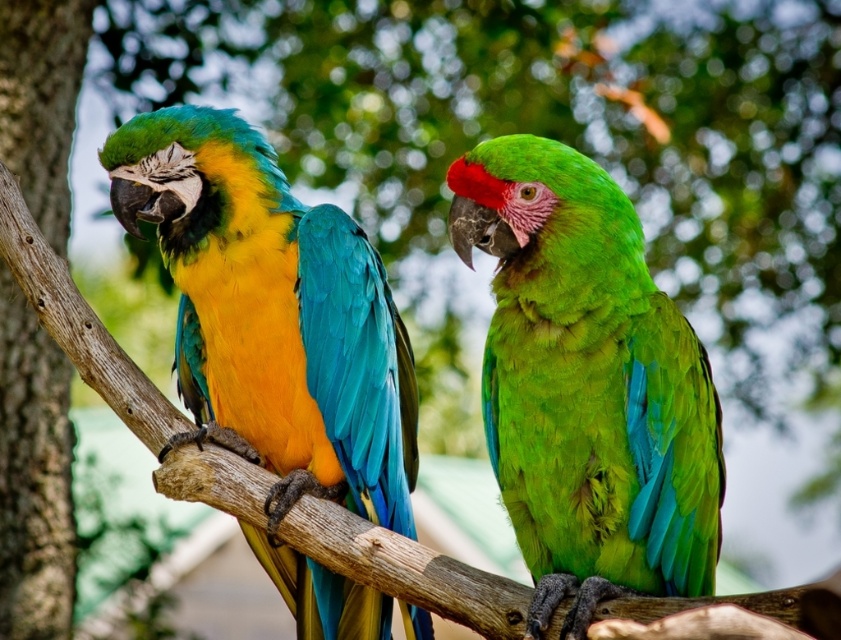
Question: Which of the following is the closest to the observer?

Choices:
 (A) green matte parrot at center
 (B) rough bark tree trunk at left

Answer: (A)

Question: Can you confirm if green matte parrot at center is wider than rough bark tree trunk at left?

Choices:
 (A) yes
 (B) no

Answer: (A)

Question: Observing the image, what is the correct spatial positioning of green matte parrot at center in reference to rough bark tree trunk at left?

Choices:
 (A) right
 (B) left

Answer: (A)

Question: Which point is closer to the camera?

Choices:
 (A) coord(414,410)
 (B) coord(71,20)
 (C) coord(559,486)

Answer: (C)

Question: Does green matte parrot at center appear over shiny multicolored parrot at left?

Choices:
 (A) yes
 (B) no

Answer: (A)

Question: Considering the real-world distances, which object is farthest from the rough bark tree trunk at left?

Choices:
 (A) shiny multicolored parrot at left
 (B) green matte parrot at center

Answer: (B)